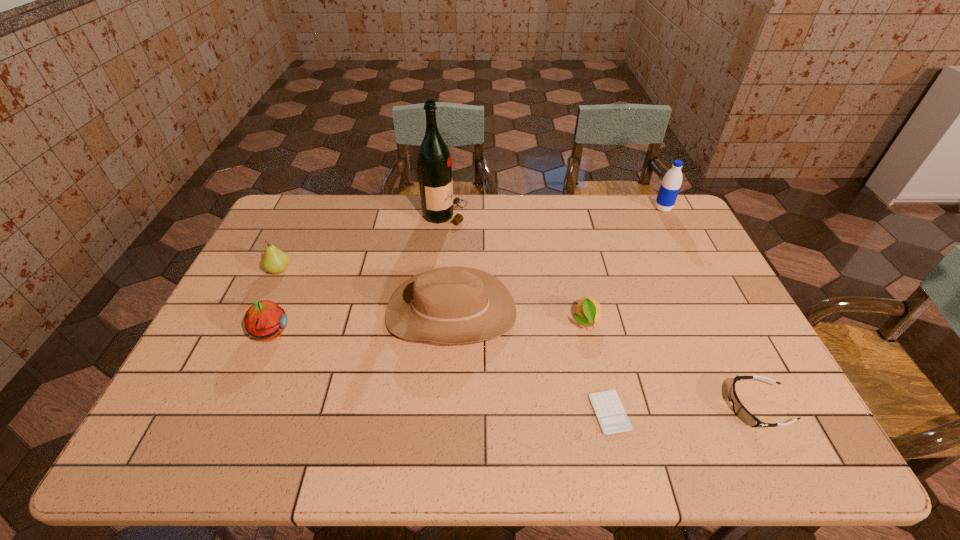
Where is `the tallest object`? The image size is (960, 540). the tallest object is located at coordinates (434, 164).

In order to click on water bottle in this screenshot , I will do `click(670, 186)`.

Identify the location of cowboy hat. The height and width of the screenshot is (540, 960). (450, 305).

Locate an element on the screen. pear is located at coordinates (275, 261).

Find the location of a particular element. apple is located at coordinates (265, 320).

I want to click on the third shortest object, so click(x=589, y=312).

Where is `goggles`? The height and width of the screenshot is (540, 960). goggles is located at coordinates (742, 413).

At what (x,y) coordinates should I click in order to perform the action: click on calculator. Please return your answer as a coordinate pair (x, y). The width and height of the screenshot is (960, 540). Looking at the image, I should click on (607, 406).

I want to click on blank space located 0.190m on the surface of the tallest object, so click(519, 214).

This screenshot has height=540, width=960. I want to click on vacant space located 0.320m on the front of the water bottle, so click(x=696, y=274).